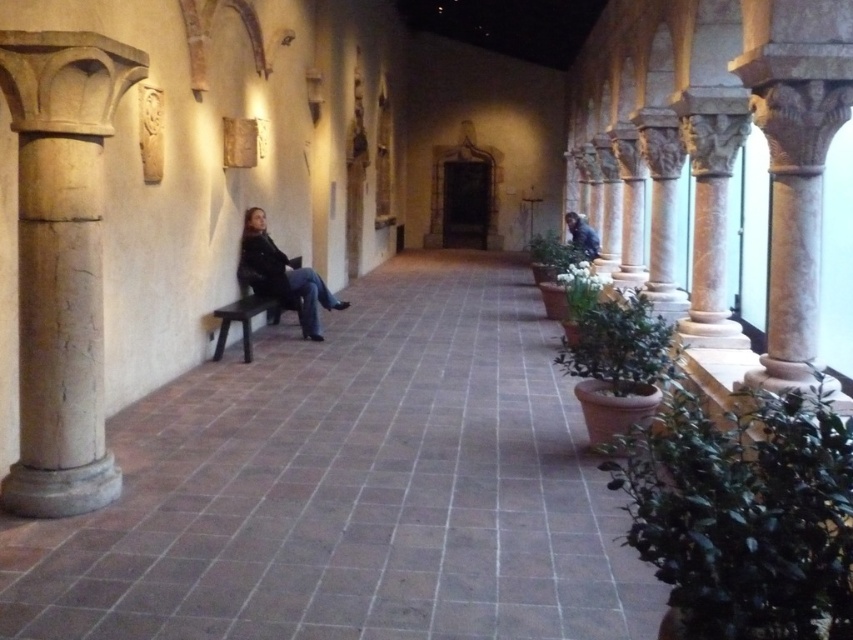
You are an architect visiting this historic space and need to seat two visitors. You have a brown stone bench at left and a dark brown wooden bench at left available. Which bench can accommodate more people?

The brown stone bench at left is bigger than the dark brown wooden bench at left, so it can accommodate more people.

You are standing in the corridor and notice the light beige stone column at left and the blue denim jacket at center. Which object is directly above the other?

The light beige stone column at left is positioned under the blue denim jacket at center, so the blue denim jacket at center is directly above the light beige stone column at left.